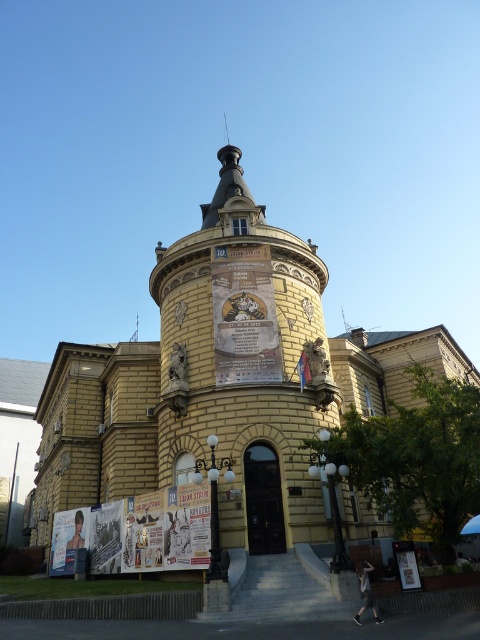
Question: Which object is the closest to the white glossy posters at lower left?

Choices:
 (A) yellow paper poster at center
 (B) yellow stone building at center

Answer: (B)

Question: Is yellow stone building at center thinner than white glossy posters at lower left?

Choices:
 (A) yes
 (B) no

Answer: (B)

Question: Does white glossy posters at lower left have a lesser width compared to yellow paper poster at center?

Choices:
 (A) no
 (B) yes

Answer: (A)

Question: Which point appears farthest from the camera in this image?

Choices:
 (A) (247, 358)
 (B) (64, 536)

Answer: (B)

Question: Which point is closer to the camera taking this photo?

Choices:
 (A) (111, 570)
 (B) (119, 349)
 (C) (268, 250)

Answer: (A)

Question: Is yellow stone building at center to the right of white glossy posters at lower left from the viewer's perspective?

Choices:
 (A) yes
 (B) no

Answer: (B)